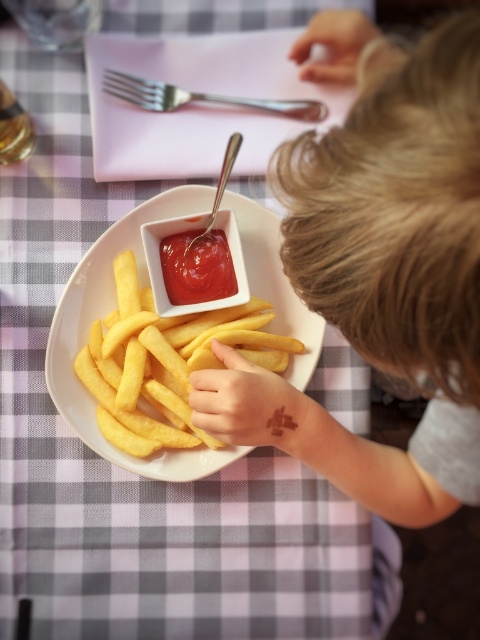
You are a child who wants to grab the shiny red ketchup at center and the satin silver fork at upper center from the table. If your hand can only reach 8 inches, can you reach both items at the same time?

The distance between the shiny red ketchup at center and the satin silver fork at upper center is 9.17 inches, which is greater than your hand reach of 8 inches. Therefore, you cannot reach both items simultaneously.

You are a food delivery robot that needs to pick up the smooth yellow fries at center and the yellow crispy french fries at center from the table. However, your robotic arm has a maximum reach of 20 centimeters. Can you grab both items without moving your position?

The distance between the smooth yellow fries at center and the yellow crispy french fries at center is 18.92 centimeters. Since the robotic arm has a maximum reach of 20 centimeters, it can reach both items without moving its position.

You are a food critic evaluating the presentation of this dish. The smooth yellow fries at center and the shiny red ketchup at center are both on the plate. Based on their visual appearance, which item do you think occupies more horizontal space on the plate?

The smooth yellow fries at center might be wider than shiny red ketchup at center, so they likely occupy more horizontal space on the plate.